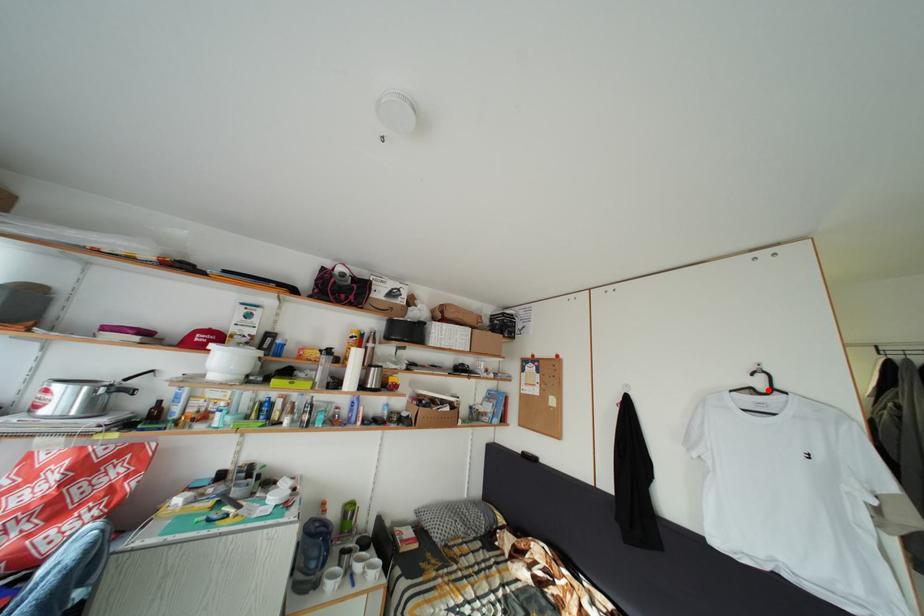
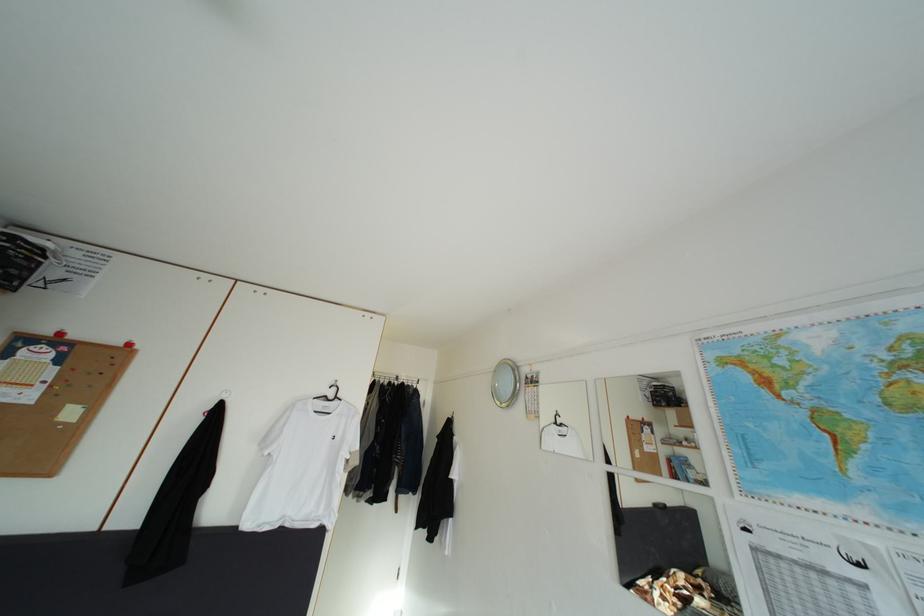
Question: A red point is marked in image1. In image2, is the corresponding 3D point closer to the camera or farther? Reply with the corresponding letter.

Choices:
 (A) The corresponding 3D point is closer.
 (B) The corresponding 3D point is farther.

Answer: (B)